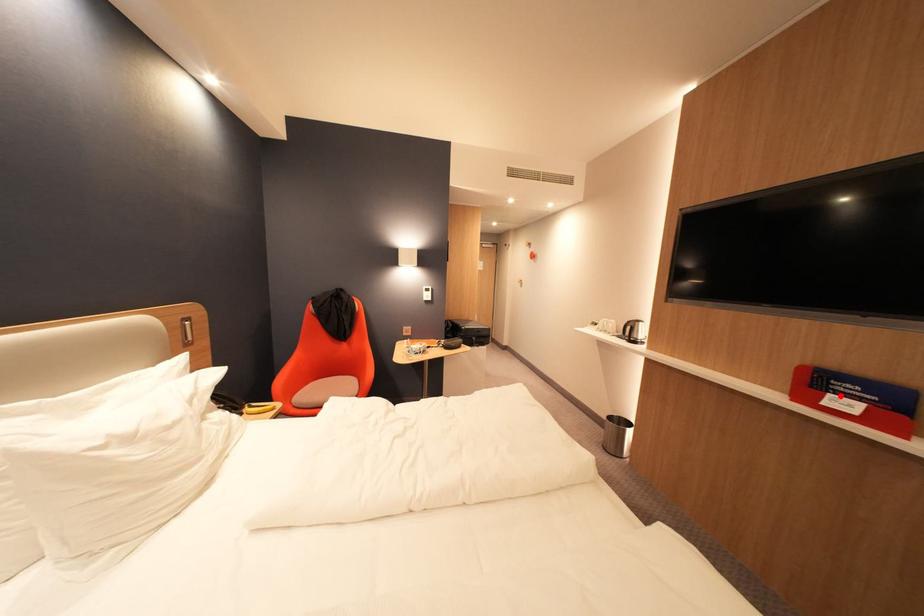
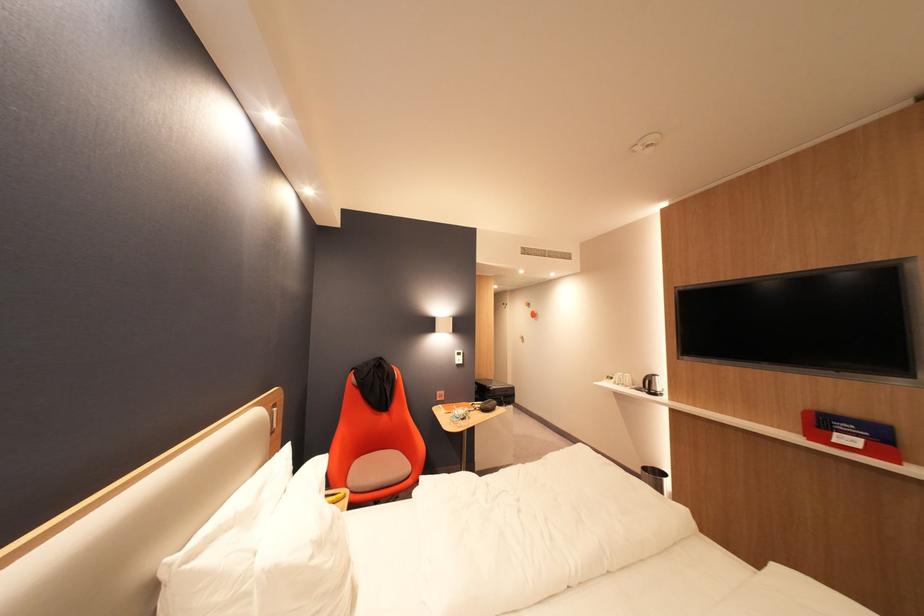
The point at the highlighted location is marked in the first image. Where is the corresponding point in the second image?

(846, 435)